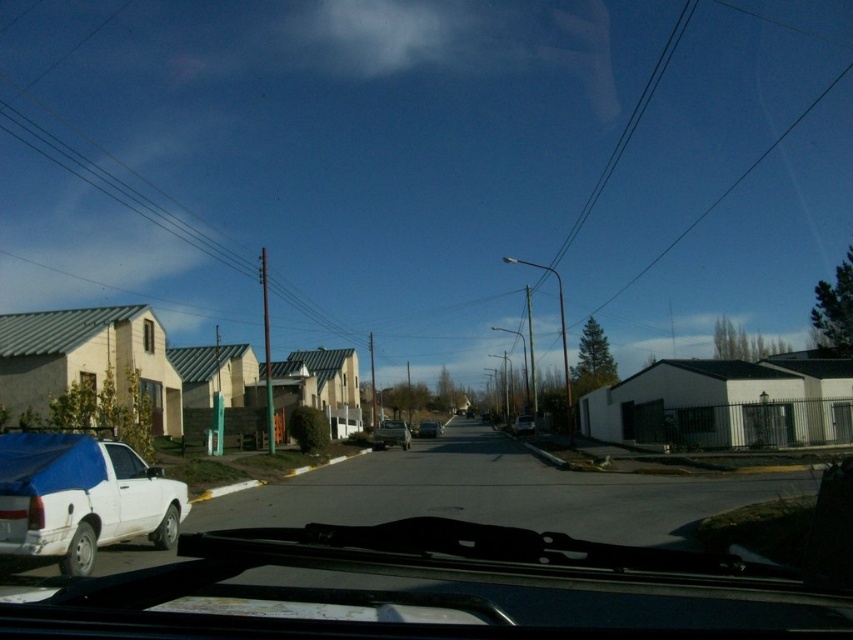
Does point (80, 435) lie in front of point (379, 438)?

Yes, point (80, 435) is in front of point (379, 438).

Does white matte truck at left have a greater height compared to silver metallic car at center?

No.

Identify the location of white matte truck at left. (80, 499).

Locate an element on the screen. Image resolution: width=853 pixels, height=640 pixels. white matte truck at left is located at coordinates (80, 499).

I want to click on silver metallic car at center, so click(392, 435).

Can you confirm if silver metallic car at center is shorter than matte black car at center?

No.

Who is more forward, (375, 428) or (422, 420)?

Point (375, 428) is more forward.

Identify the location of silver metallic car at center. (392, 435).

Can you confirm if white matte car window at lower left is bigger than matte black car at center?

No, white matte car window at lower left is not bigger than matte black car at center.

Who is more distant from viewer, [125,452] or [422,436]?

The point [422,436] is more distant.

Where is `white matte car window at lower left`? white matte car window at lower left is located at coordinates (125, 461).